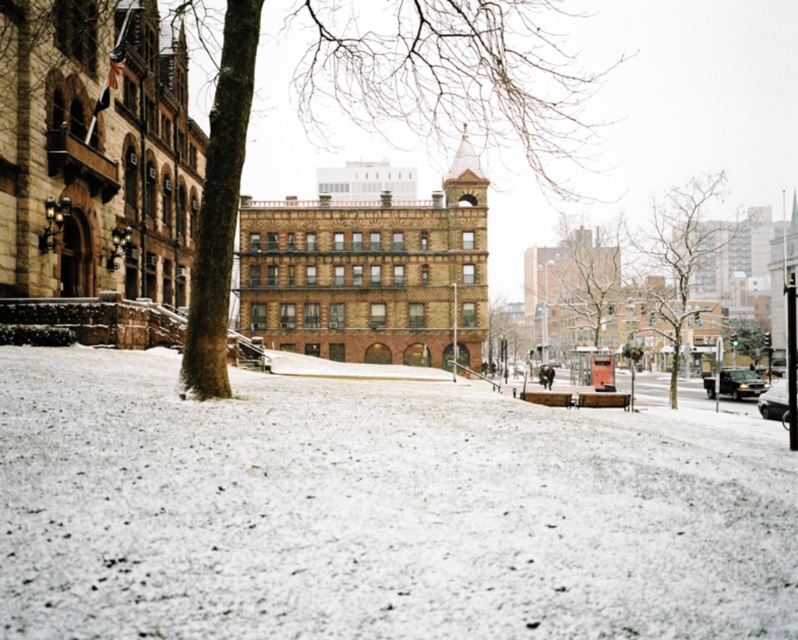
You are standing at the center of the snow covered ground in the park. You want to walk to the smooth brown tree at center. Which direction should you walk to reach it?

The smooth brown tree at center is located at point (571, 289), so you should walk towards the center of the scene to reach it.

You are standing in the winter scene described. You want to place a small snowman exactly at the point marked by point (x=377, y=509). Is there enough snow at white powdery snow at lower center to build a snowman there?

The point (x=377, y=509) marks white powdery snow at lower center, which is described as having a thin layer of snow with patches of grass peeking through. Since the snow is thin and has grass visible, there may not be enough snow to build a snowman at that location.